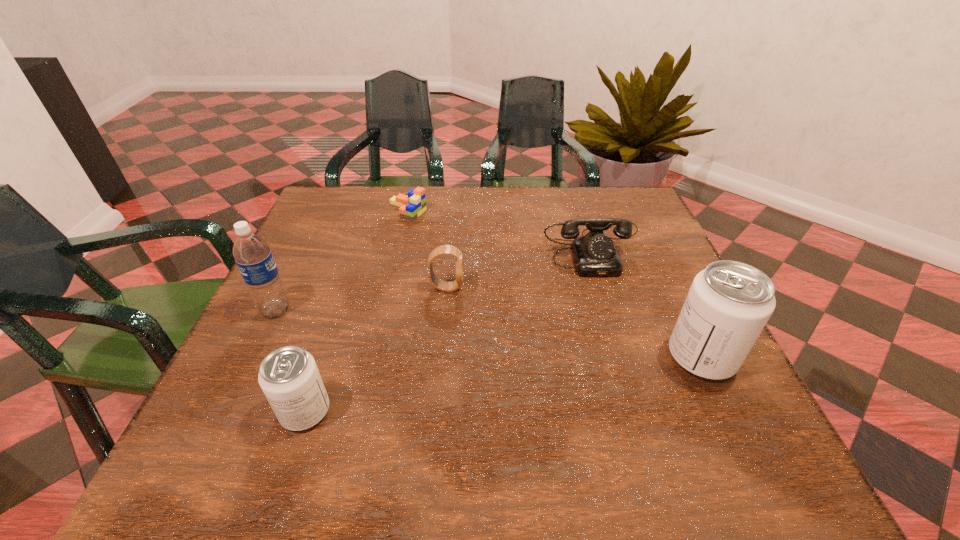
This screenshot has width=960, height=540. Find the location of `vacant spot for a new pop_(soda) to ensure equal spacing`. vacant spot for a new pop_(soda) to ensure equal spacing is located at coordinates (515, 383).